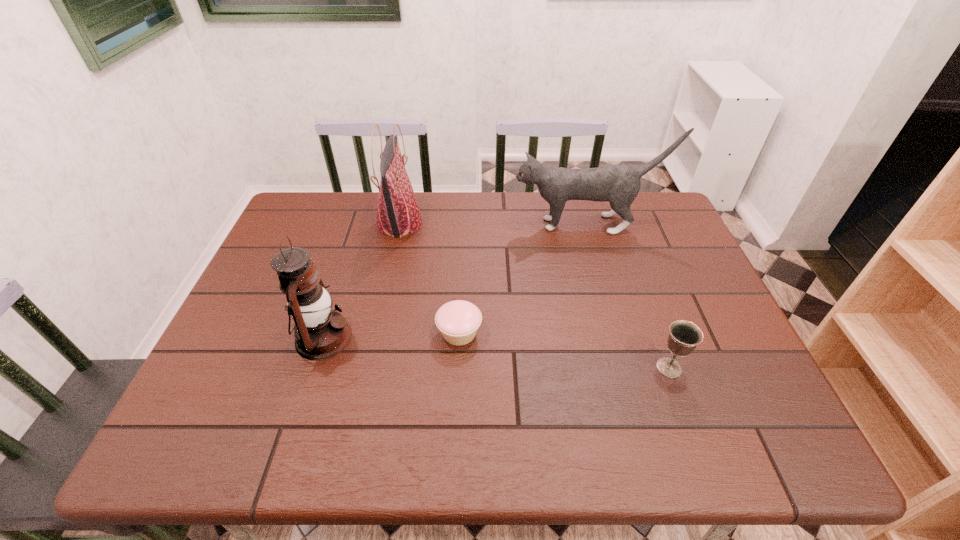
I want to click on vacant space that is in between the handbag and the chalice, so click(535, 295).

Locate an element on the screen. The height and width of the screenshot is (540, 960). free space between the cat and the third object from left to right is located at coordinates click(523, 278).

You are a GUI agent. You are given a task and a screenshot of the screen. Output one action in this format:
    pyautogui.click(x=<x>, y=<y>)
    Task: Click on the free space between the fourth tallest object and the shortest object
    The image size is (960, 540).
    Given the screenshot: What is the action you would take?
    pyautogui.click(x=564, y=350)

Where is `free space between the chalice and the lantern`? free space between the chalice and the lantern is located at coordinates (496, 353).

Identify the location of object that is the fourth closest to the lantern. (684, 336).

You are a GUI agent. You are given a task and a screenshot of the screen. Output one action in this format:
    pyautogui.click(x=<x>, y=<y>)
    Task: Click on the second closest object to the chalice
    Image resolution: width=960 pixels, height=540 pixels.
    Given the screenshot: What is the action you would take?
    pyautogui.click(x=619, y=184)

This screenshot has width=960, height=540. I want to click on free space in the image that satisfies the following two spatial constraints: 1. on the front side of the handbag; 2. on the side of the lantern, there is a wick adjustment knob, so click(375, 338).

This screenshot has height=540, width=960. I want to click on blank space that satisfies the following two spatial constraints: 1. on the front side of the chalice; 2. on the right side of the cupcake, so click(x=458, y=368).